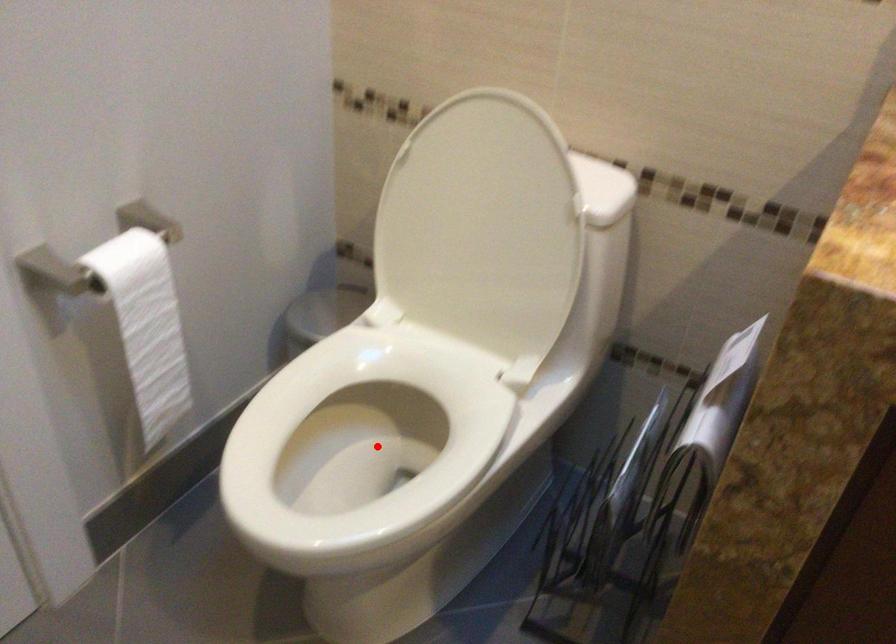
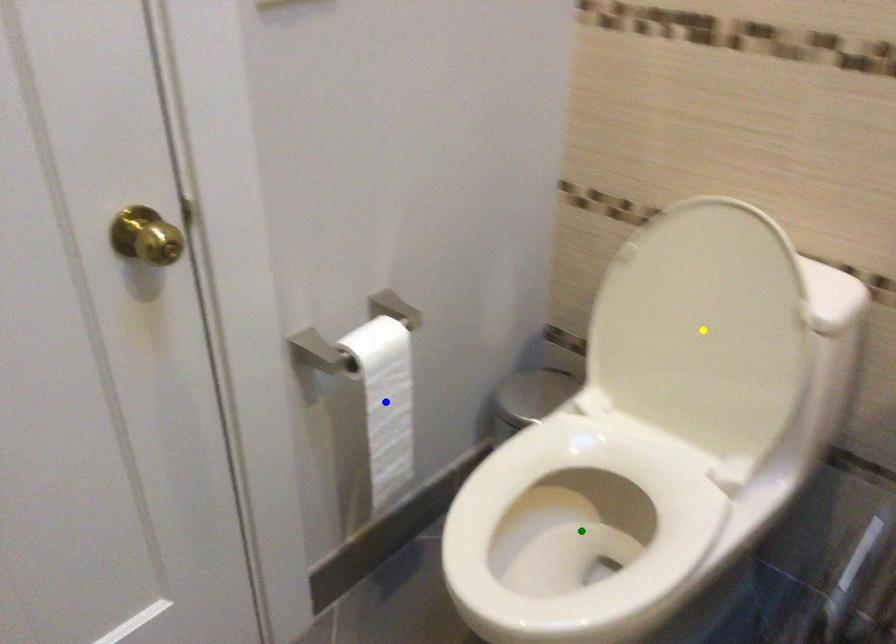
Question: I am providing you with two images of the same scene from different viewpoints. A red point is marked on the first image. You are given multiple points on the second image. Which spot in image 2 lines up with the point in image 1?

Choices:
 (A) blue point
 (B) green point
 (C) yellow point

Answer: (B)